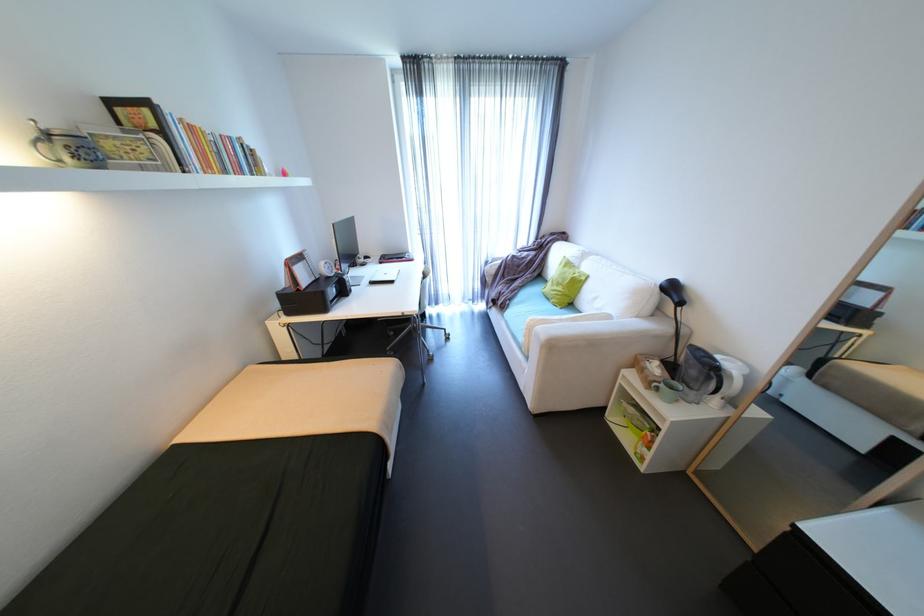
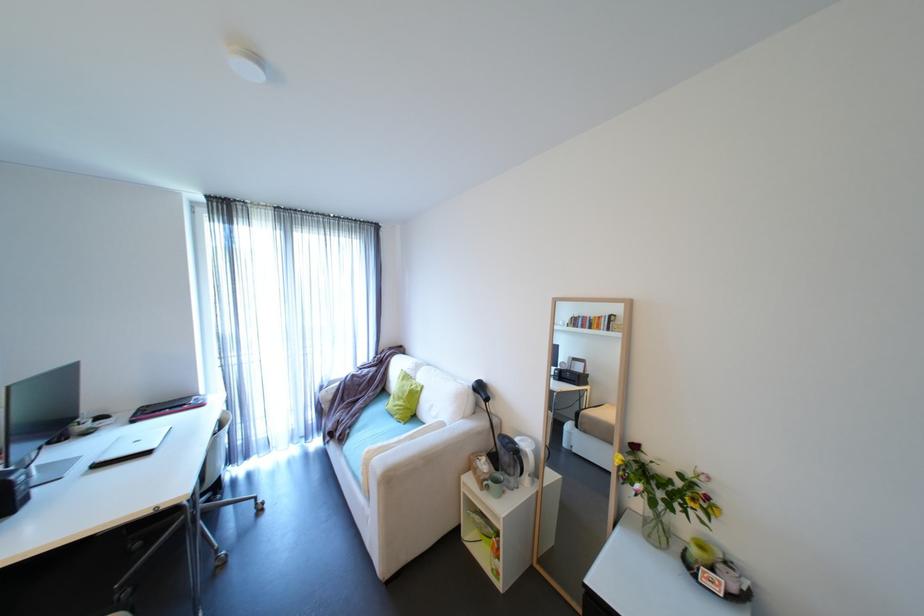
Where in the second image is the point corresponding to (730,360) from the first image?

(527, 440)